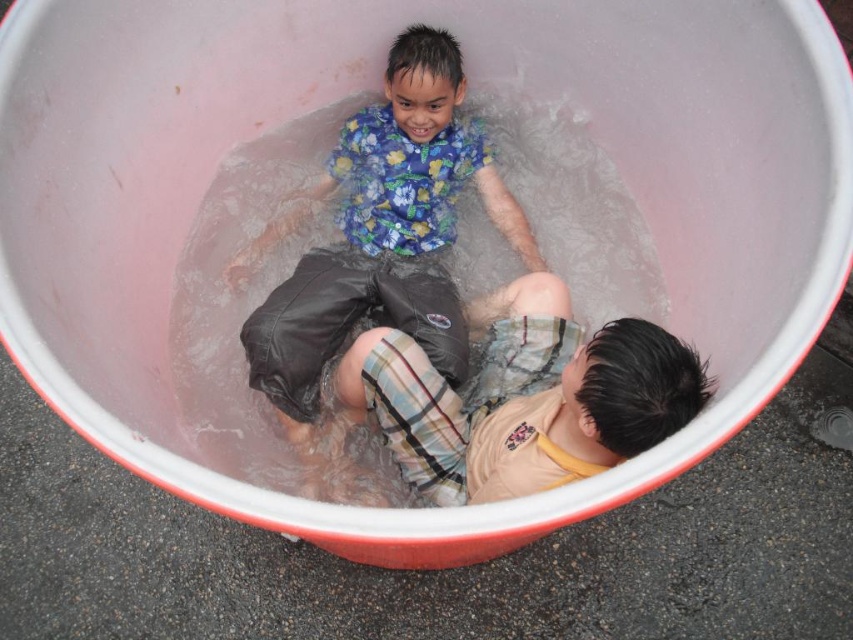
Question: Does floral fabric shirt at upper center appear on the left side of plaid cotton shorts at lower right?

Choices:
 (A) no
 (B) yes

Answer: (B)

Question: Does floral fabric shirt at upper center appear on the right side of plaid cotton shorts at lower right?

Choices:
 (A) yes
 (B) no

Answer: (B)

Question: Is the position of floral fabric shirt at upper center less distant than that of plaid cotton shorts at lower right?

Choices:
 (A) yes
 (B) no

Answer: (B)

Question: Which object is farther from the camera taking this photo?

Choices:
 (A) plaid cotton shorts at lower right
 (B) floral fabric shirt at upper center

Answer: (B)